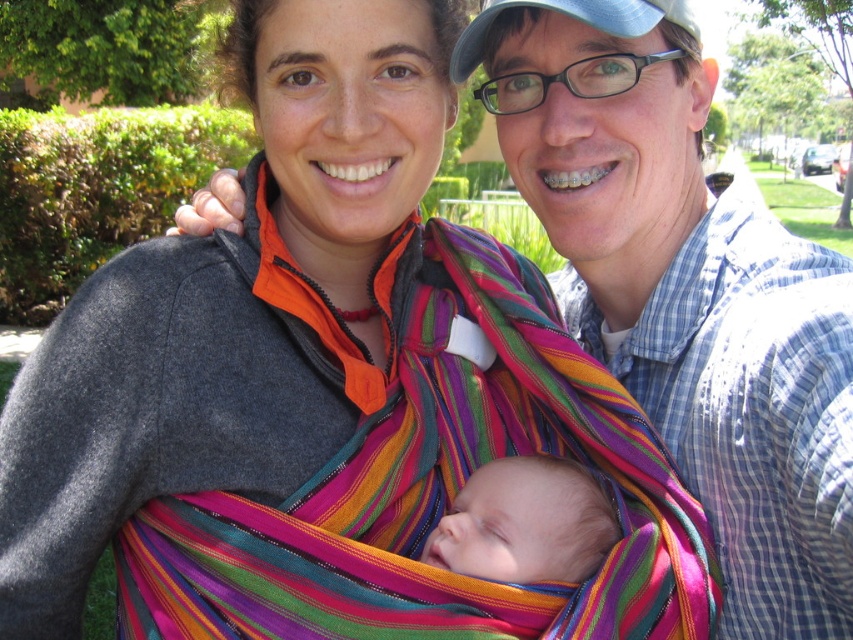
Does soft pink fabric at center appear under blue fabric baseball cap at upper center?

Indeed, soft pink fabric at center is positioned under blue fabric baseball cap at upper center.

Between soft pink fabric at center and blue fabric baseball cap at upper center, which one is positioned lower?

soft pink fabric at center is below.

Find the location of `soft pink fabric at center`. soft pink fabric at center is located at coordinates (525, 524).